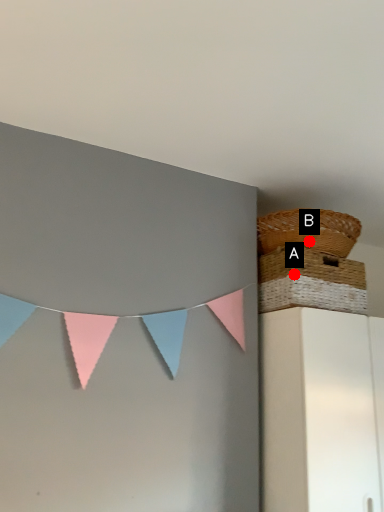
Question: Two points are circled on the image, labeled by A and B beside each circle. Which point appears farthest from the camera in this image?

Choices:
 (A) A is further
 (B) B is further

Answer: (B)